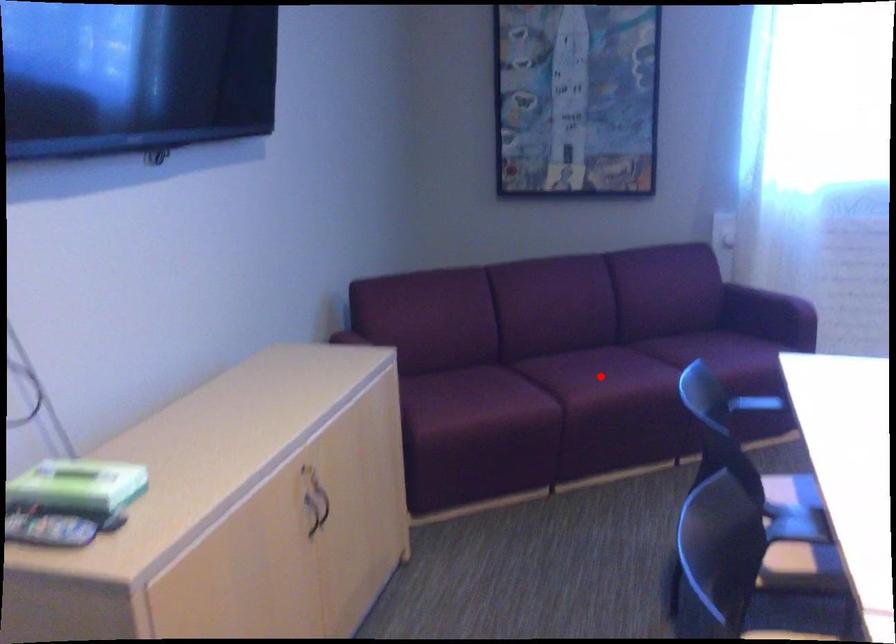
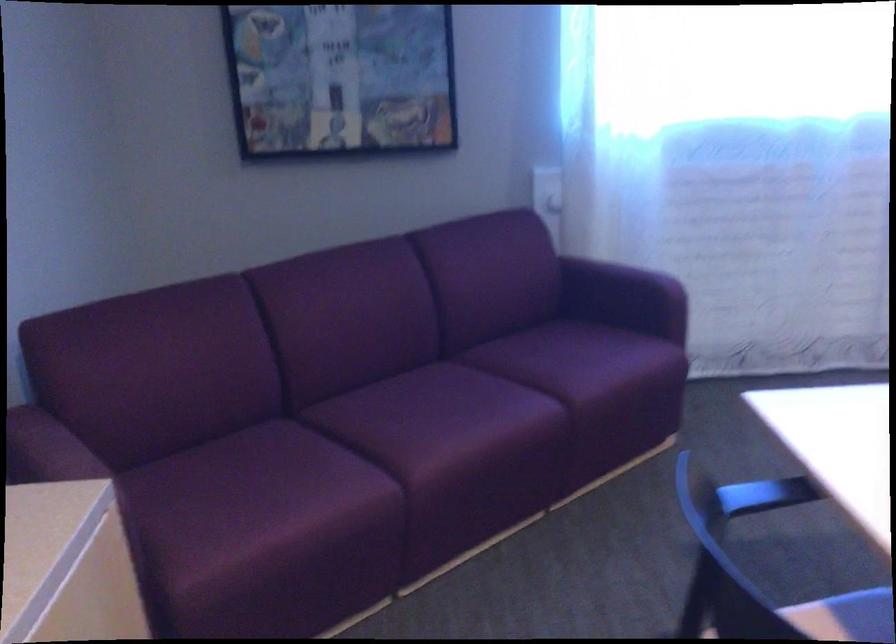
Locate, in the second image, the point that corresponds to the highlighted location in the first image.

(445, 422)